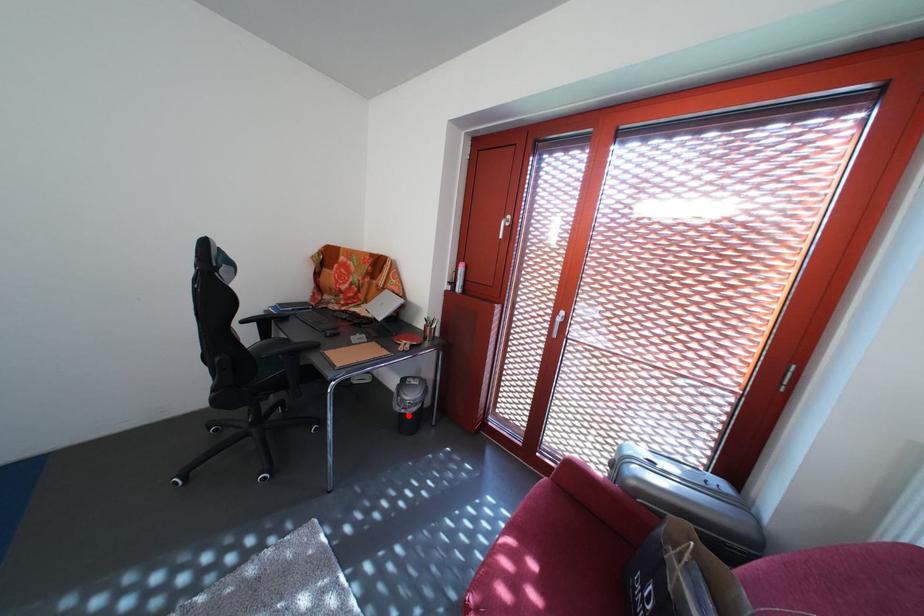
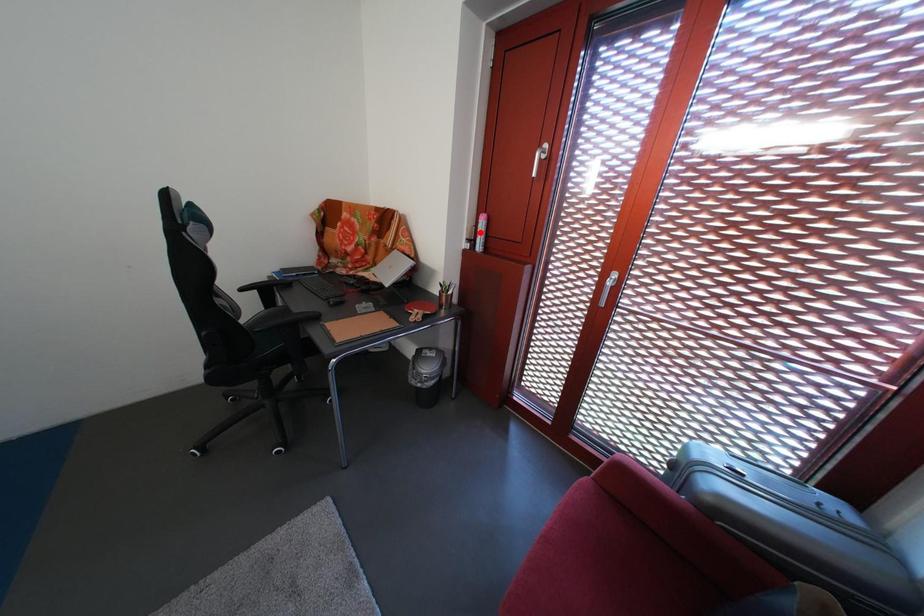
I am providing you with two images of the same scene from different viewpoints. A red point is marked on the first image and another point is marked on the second image. Is the marked point in image1 the same physical position as the marked point in image2?

No